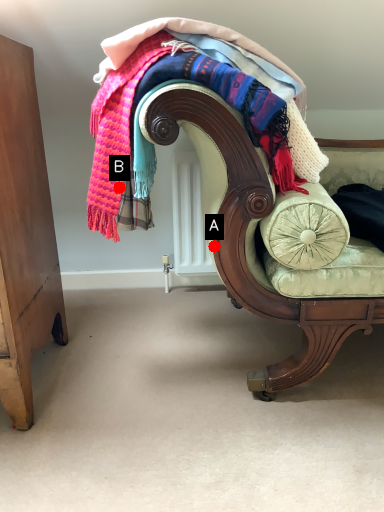
Question: Two points are circled on the image, labeled by A and B beside each circle. Among these points, which one is farthest from the camera?

Choices:
 (A) A is further
 (B) B is further

Answer: (B)